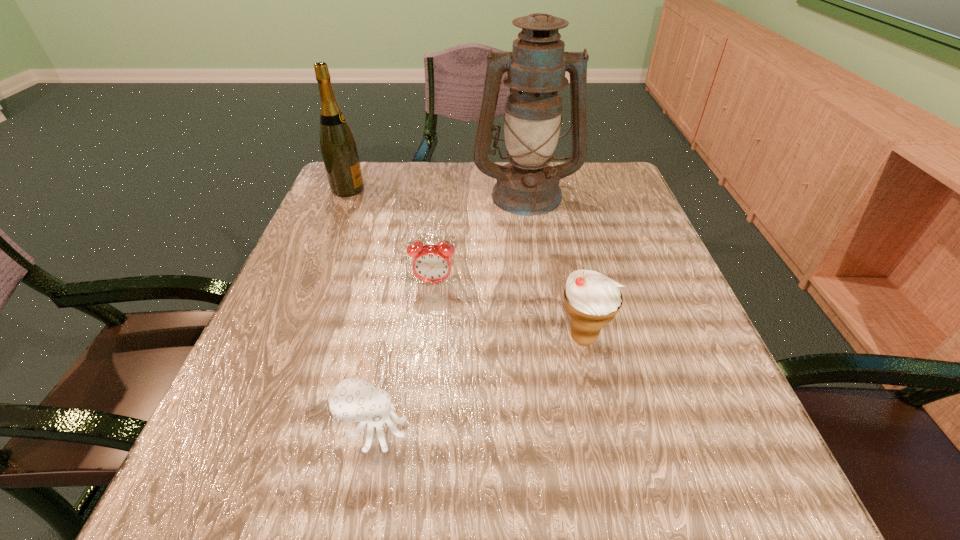
You are a GUI agent. You are given a task and a screenshot of the screen. Output one action in this format:
    pyautogui.click(x=<x>, y=<y>)
    Task: Click on the tallest object
    This screenshot has height=540, width=960.
    Given the screenshot: What is the action you would take?
    pyautogui.click(x=536, y=67)

You are a GUI agent. You are given a task and a screenshot of the screen. Output one action in this format:
    pyautogui.click(x=<x>, y=<y>)
    Task: Click on the wine bottle
    
    Given the screenshot: What is the action you would take?
    pyautogui.click(x=338, y=147)

You are a GUI agent. You are given a task and a screenshot of the screen. Output one action in this format:
    pyautogui.click(x=<x>, y=<y>)
    Task: Click on the leftmost object
    Image resolution: width=960 pixels, height=540 pixels.
    Given the screenshot: What is the action you would take?
    pyautogui.click(x=338, y=147)

Where is `icecream`? This screenshot has height=540, width=960. icecream is located at coordinates (592, 300).

At what (x,y) coordinates should I click in order to perform the action: click on the third shortest object. Please return your answer as a coordinate pair (x, y). Looking at the image, I should click on (592, 300).

This screenshot has width=960, height=540. Find the location of `alarm clock`. alarm clock is located at coordinates point(431,263).

Find the location of a particular element. octopus is located at coordinates (352, 400).

Find the location of `free location located 0.180m on the front of the tallest object`. free location located 0.180m on the front of the tallest object is located at coordinates (538, 268).

Image resolution: width=960 pixels, height=540 pixels. In order to click on vacant space located 0.400m on the front-facing side of the leftmost object in this screenshot , I will do `click(528, 189)`.

You are a GUI agent. You are given a task and a screenshot of the screen. Output one action in this format:
    pyautogui.click(x=<x>, y=<y>)
    Task: Click on the free location located on the left of the second nearest object
    
    Given the screenshot: What is the action you would take?
    pyautogui.click(x=364, y=338)